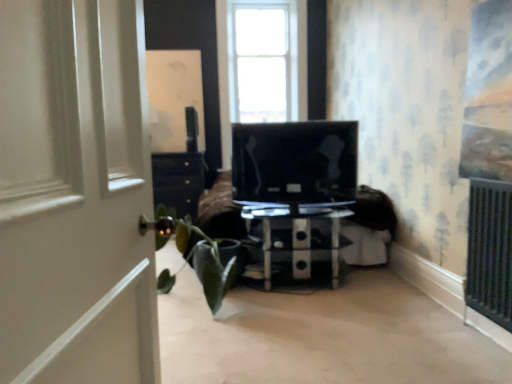
Question: Is white wooden door at left at the back of green matte houseplant at left?

Choices:
 (A) yes
 (B) no

Answer: (B)

Question: Is green matte houseplant at left touching white wooden door at left?

Choices:
 (A) no
 (B) yes

Answer: (A)

Question: From a real-world perspective, is green matte houseplant at left physically below white wooden door at left?

Choices:
 (A) no
 (B) yes

Answer: (B)

Question: Is green matte houseplant at left positioned behind white wooden door at left?

Choices:
 (A) no
 (B) yes

Answer: (B)

Question: Does green matte houseplant at left have a larger size compared to white wooden door at left?

Choices:
 (A) no
 (B) yes

Answer: (B)

Question: Does green matte houseplant at left appear on the left side of white wooden door at left?

Choices:
 (A) no
 (B) yes

Answer: (B)

Question: Is white wooden door at left next to black glossy tv at center?

Choices:
 (A) yes
 (B) no

Answer: (B)

Question: Is white wooden door at left to the right of black glossy tv at center from the viewer's perspective?

Choices:
 (A) no
 (B) yes

Answer: (A)

Question: From the image's perspective, does white wooden door at left appear higher than black glossy tv at center?

Choices:
 (A) no
 (B) yes

Answer: (A)

Question: Does white wooden door at left have a lesser width compared to black glossy tv at center?

Choices:
 (A) yes
 (B) no

Answer: (A)

Question: Can you confirm if white wooden door at left is smaller than black glossy tv at center?

Choices:
 (A) yes
 (B) no

Answer: (B)

Question: From a real-world perspective, is white wooden door at left on black glossy tv at center?

Choices:
 (A) no
 (B) yes

Answer: (A)

Question: From a real-world perspective, is transparent glass coffee table at center under green matte houseplant at left?

Choices:
 (A) yes
 (B) no

Answer: (A)